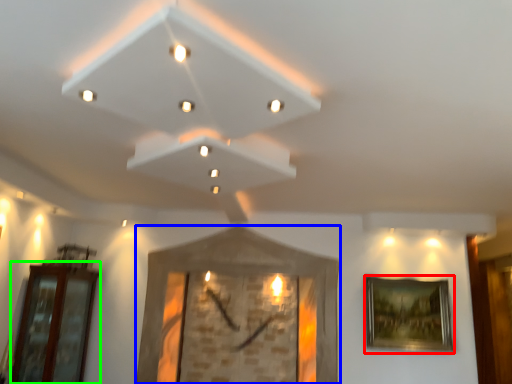
Question: Based on their relative distances, which object is farther from picture frame (highlighted by a red box)? Choose from picture frame (highlighted by a blue box) and glass door (highlighted by a green box).

Choices:
 (A) picture frame
 (B) glass door

Answer: (B)